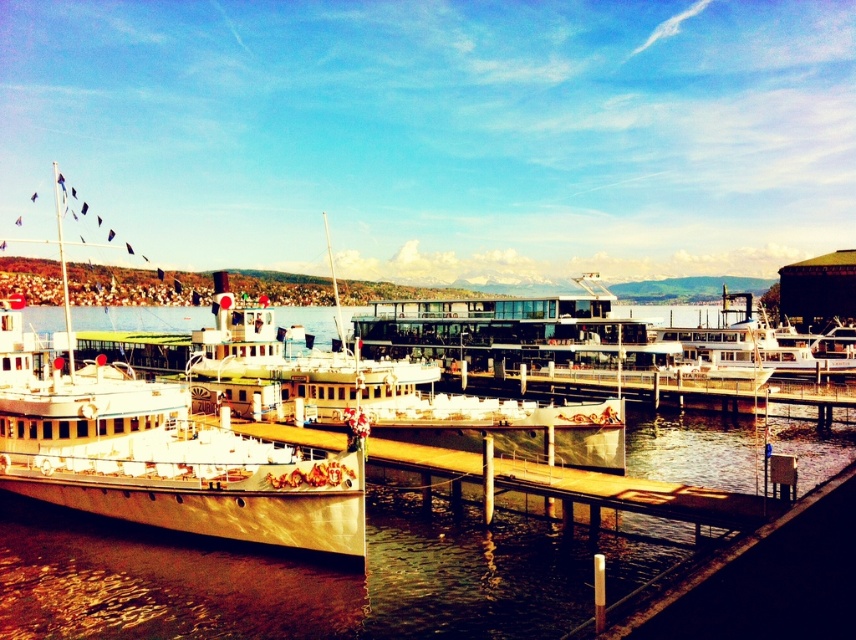
You are a delivery drone with a maximum flight range of 25 meters. You need to deliver a package from the metallic gold boat at left to the metallic water at center. Can you complete the delivery without needing a recharge?

The metallic water at center and metallic gold boat at left are 25.14 meters apart from each other. Since the distance exceeds the drone maximum flight range of 25 meters, the drone cannot complete the delivery without needing a recharge.

Based on the scene description, where is the metallic water at center located in terms of coordinates?

The metallic water at center is located at coordinates point (316,576).

You are a photographer standing at the waterfront. You want to capture a photo that includes both the metallic water at center and the metallic gold boat at left. Based on their positions, which object should appear higher in your photo?

The metallic water at center should appear higher in the photo because it is positioned above the metallic gold boat at left according to the description.